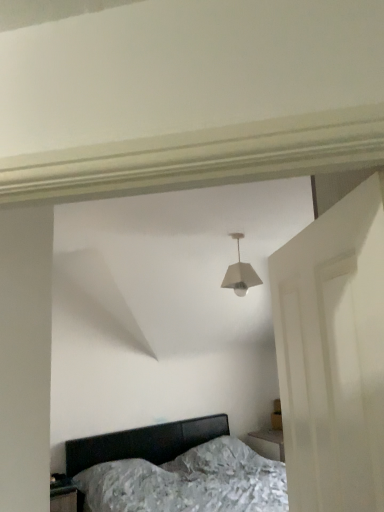
Question: Can you confirm if matte black bed at lower center is taller than white matte lampshade at center?

Choices:
 (A) yes
 (B) no

Answer: (A)

Question: From a real-world perspective, does matte black bed at lower center sit lower than white matte lampshade at center?

Choices:
 (A) yes
 (B) no

Answer: (A)

Question: Is matte black bed at lower center oriented towards white matte lampshade at center?

Choices:
 (A) yes
 (B) no

Answer: (B)

Question: Does matte black bed at lower center come in front of white matte lampshade at center?

Choices:
 (A) no
 (B) yes

Answer: (B)

Question: Can we say matte black bed at lower center lies outside white matte lampshade at center?

Choices:
 (A) yes
 (B) no

Answer: (A)

Question: Is matte black bed at lower center in contact with white matte lampshade at center?

Choices:
 (A) yes
 (B) no

Answer: (B)

Question: Is white matte lampshade at center wider than matte black bed at lower center?

Choices:
 (A) no
 (B) yes

Answer: (A)

Question: From a real-world perspective, is white matte lampshade at center physically above matte black bed at lower center?

Choices:
 (A) yes
 (B) no

Answer: (A)

Question: Is white matte lampshade at center oriented away from matte black bed at lower center?

Choices:
 (A) no
 (B) yes

Answer: (A)

Question: Is the surface of white matte lampshade at center in direct contact with matte black bed at lower center?

Choices:
 (A) yes
 (B) no

Answer: (B)

Question: Considering the relative sizes of white matte lampshade at center and matte black bed at lower center in the image provided, is white matte lampshade at center taller than matte black bed at lower center?

Choices:
 (A) no
 (B) yes

Answer: (A)

Question: Does white matte lampshade at center have a larger size compared to matte black bed at lower center?

Choices:
 (A) yes
 (B) no

Answer: (B)

Question: From a real-world perspective, is white matte lampshade at center located beneath white matte door at right?

Choices:
 (A) no
 (B) yes

Answer: (A)